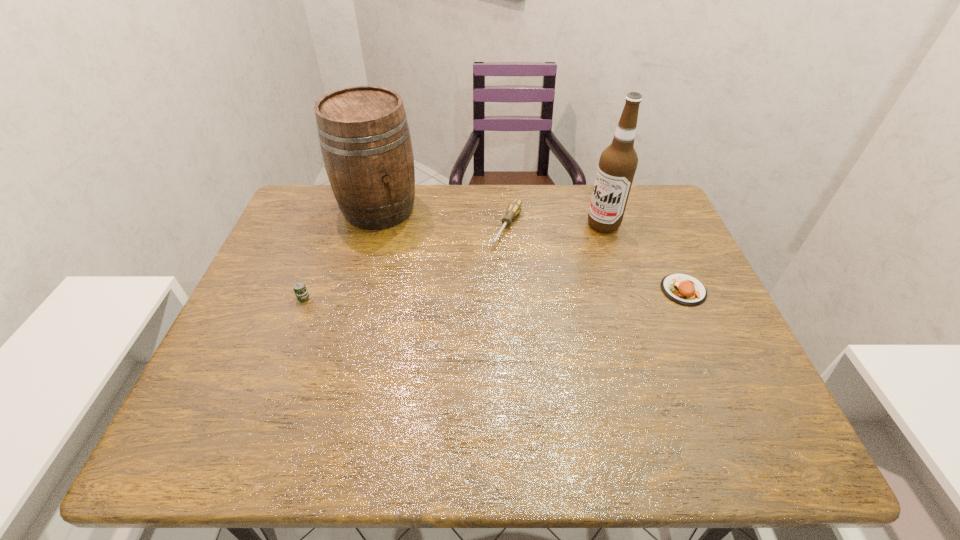
Identify the location of the third tallest object. The image size is (960, 540). (301, 292).

Image resolution: width=960 pixels, height=540 pixels. What are the coordinates of `patty (food)` in the screenshot? It's located at (684, 289).

Identify the location of the third object from right to left. (514, 208).

I want to click on the second object from right to left, so click(618, 162).

The width and height of the screenshot is (960, 540). What are the coordinates of `cider` in the screenshot? It's located at (364, 136).

The height and width of the screenshot is (540, 960). Find the location of `free region located 0.350m on the back of the third tallest object`. free region located 0.350m on the back of the third tallest object is located at coordinates (340, 204).

Where is `free point located on the left of the rightmost object`? free point located on the left of the rightmost object is located at coordinates (555, 290).

This screenshot has height=540, width=960. I want to click on free location located at the tip of the screwdriver, so click(456, 329).

Locate an element on the screen. The width and height of the screenshot is (960, 540). vacant space situated 0.080m at the tip of the screwdriver is located at coordinates (492, 267).

The height and width of the screenshot is (540, 960). Find the location of `vacant region located 0.110m at the tip of the screwdriver`. vacant region located 0.110m at the tip of the screwdriver is located at coordinates (488, 274).